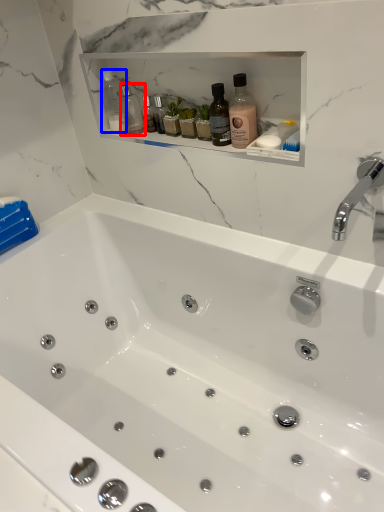
Question: Which object is further to the camera taking this photo, bottle (highlighted by a red box) or bottle (highlighted by a blue box)?

Choices:
 (A) bottle
 (B) bottle

Answer: (A)